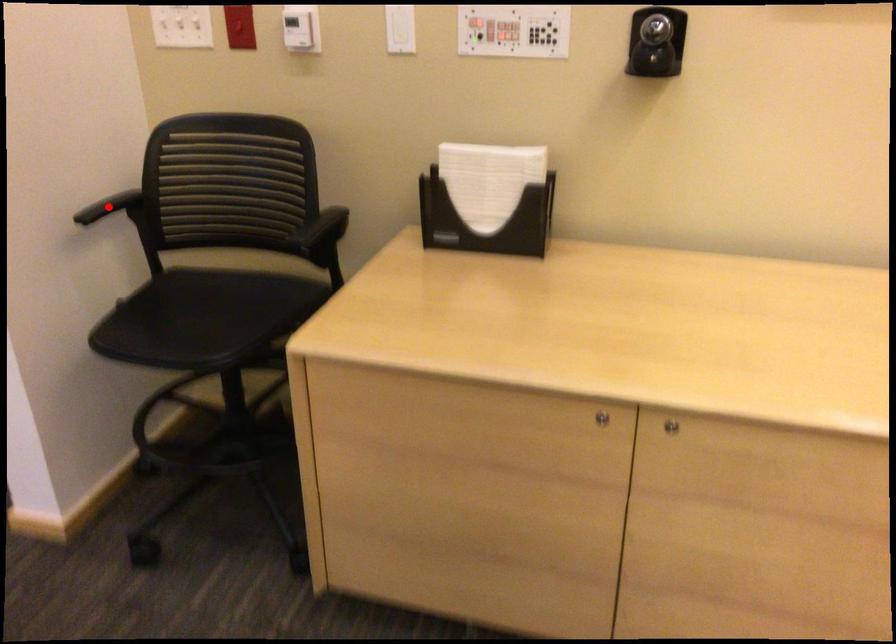
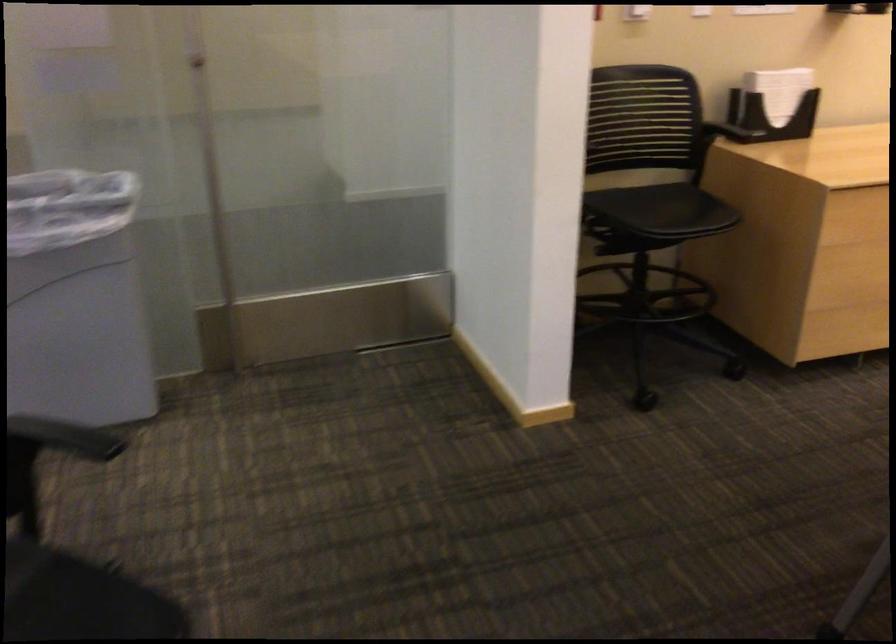
Question: I am providing you with two images of the same scene from different viewpoints. A red point is marked on the first image. Can you still see the location of the red point in image 2?

Choices:
 (A) Yes
 (B) No

Answer: (B)